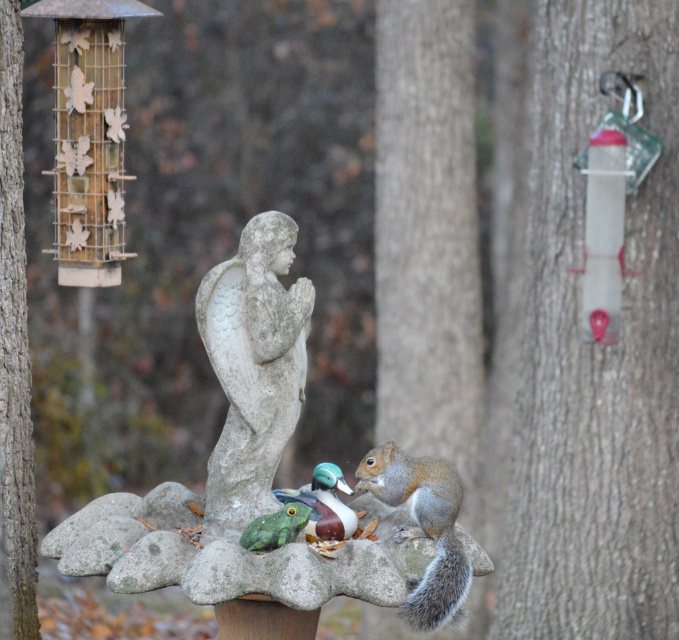
Measure the distance from smooth bark tree at right to gray stone statue at center.

smooth bark tree at right is 2.21 meters from gray stone statue at center.

Does smooth bark tree at right come in front of gray stone statue at center?

No, smooth bark tree at right is further to the viewer.

Is point (672, 312) more distant than point (291, 248)?

That is True.

Identify the location of smooth bark tree at right. The image size is (679, 640). (595, 353).

Between gray stone statue at center and smooth brown bark at left, which one appears on the left side from the viewer's perspective?

smooth brown bark at left is more to the left.

Is gray stone statue at center positioned in front of smooth brown bark at left?

Yes.

Image resolution: width=679 pixels, height=640 pixels. Identify the location of gray stone statue at center. 253,369.

The width and height of the screenshot is (679, 640). What do you see at coordinates (253, 369) in the screenshot?
I see `gray stone statue at center` at bounding box center [253, 369].

Between gray stone statue at center and gray furry squirrel at lower right, which one appears on the right side from the viewer's perspective?

gray furry squirrel at lower right is more to the right.

This screenshot has height=640, width=679. Describe the element at coordinates (253, 369) in the screenshot. I see `gray stone statue at center` at that location.

Where is `gray stone statue at center`? This screenshot has width=679, height=640. gray stone statue at center is located at coordinates (253, 369).